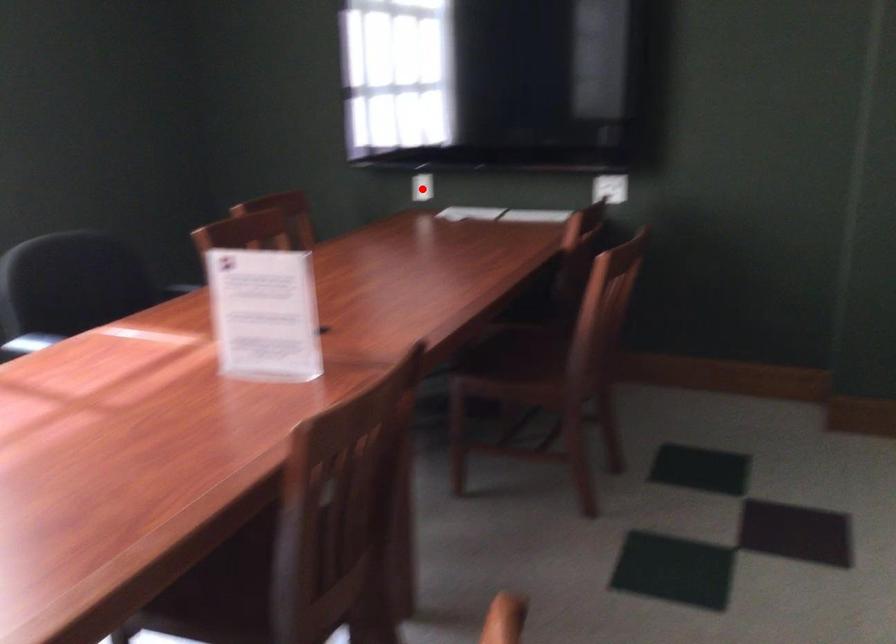
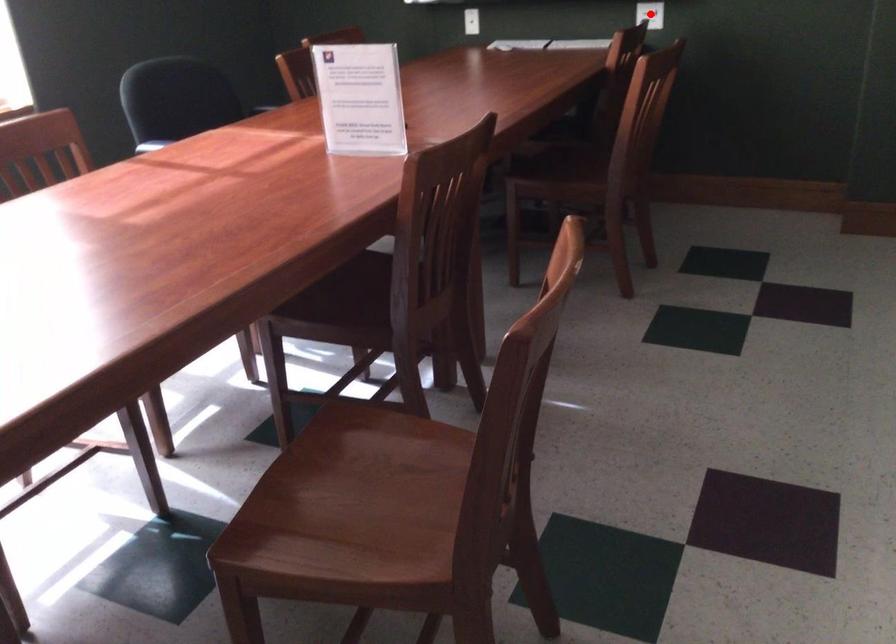
I am providing you with two images of the same scene from different viewpoints. A red point is marked on the first image and another point is marked on the second image. Do the highlighted points in image1 and image2 indicate the same real-world spot?

No